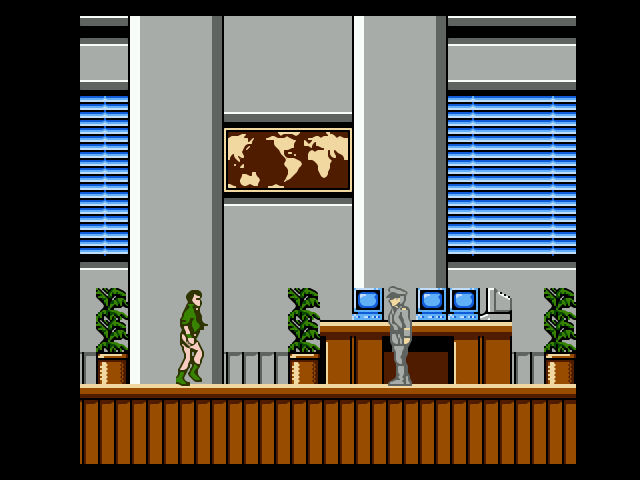
Identify the location of gray computer. The width and height of the screenshot is (640, 480). (493, 307).